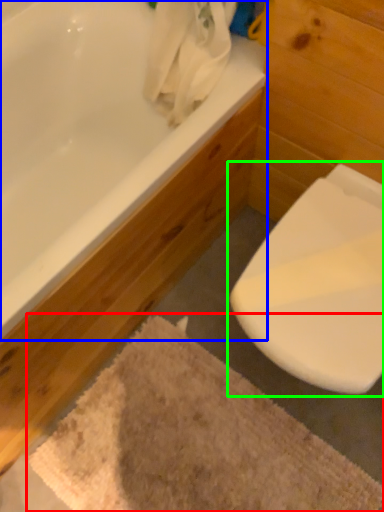
Question: Which object is positioned closest to bath mat (highlighted by a red box)? Select from bathtub (highlighted by a blue box) and toilet (highlighted by a green box).

Choices:
 (A) bathtub
 (B) toilet

Answer: (B)